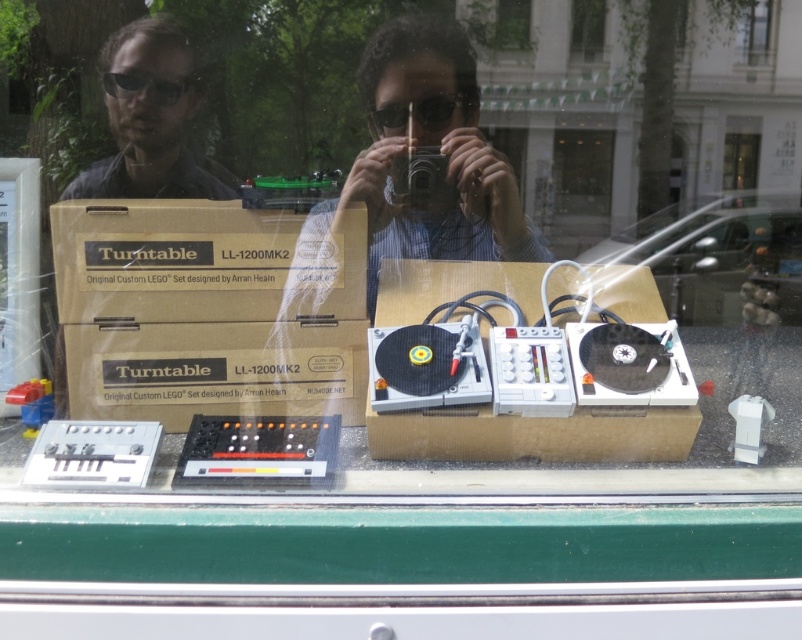
Question: Which object is the farthest from the black plastic goggles at center?

Choices:
 (A) clear glass window at upper center
 (B) white cardboard box at center
 (C) black plastic goggles at upper left
 (D) brown cardboard at center

Answer: (A)

Question: Is black plastic goggles at upper left positioned in front of clear glass window at upper center?

Choices:
 (A) no
 (B) yes

Answer: (B)

Question: Is black plastic goggles at center thinner than clear glass window at upper center?

Choices:
 (A) no
 (B) yes

Answer: (A)

Question: Is brown cardboard at center below clear glass window at upper center?

Choices:
 (A) yes
 (B) no

Answer: (A)

Question: Which point is farther to the camera?

Choices:
 (A) black plastic goggles at center
 (B) clear glass window at upper center
 (C) black plastic goggles at upper left
 (D) brown cardboard at center

Answer: (B)

Question: Which point is farther from the camera taking this photo?

Choices:
 (A) (768, 19)
 (B) (393, 131)

Answer: (A)